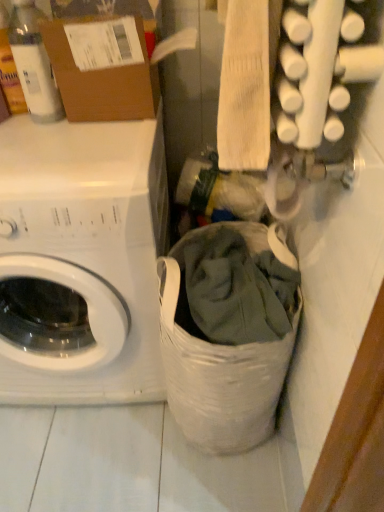
Question: Is white matte washing machine at left aimed at translucent plastic bottle at upper left?

Choices:
 (A) yes
 (B) no

Answer: (B)

Question: Is white matte washing machine at left bigger than translucent plastic bottle at upper left?

Choices:
 (A) yes
 (B) no

Answer: (A)

Question: From a real-world perspective, is white matte washing machine at left physically above translucent plastic bottle at upper left?

Choices:
 (A) no
 (B) yes

Answer: (A)

Question: From the image's perspective, is white matte washing machine at left on translucent plastic bottle at upper left?

Choices:
 (A) no
 (B) yes

Answer: (A)

Question: Is white matte washing machine at left further to the viewer compared to translucent plastic bottle at upper left?

Choices:
 (A) no
 (B) yes

Answer: (A)

Question: From a real-world perspective, is brown cardboard box at upper left above or below white fabric laundry basket at lower center?

Choices:
 (A) above
 (B) below

Answer: (A)

Question: Considering the positions of brown cardboard box at upper left and white fabric laundry basket at lower center in the image, is brown cardboard box at upper left taller or shorter than white fabric laundry basket at lower center?

Choices:
 (A) short
 (B) tall

Answer: (A)

Question: From the image's perspective, is brown cardboard box at upper left above or below white fabric laundry basket at lower center?

Choices:
 (A) below
 (B) above

Answer: (B)

Question: Is brown cardboard box at upper left in front of or behind white fabric laundry basket at lower center in the image?

Choices:
 (A) behind
 (B) front

Answer: (A)

Question: Which is correct: white fabric laundry basket at lower center is inside brown cardboard box at upper left, or outside of it?

Choices:
 (A) inside
 (B) outside

Answer: (B)

Question: From a real-world perspective, is white fabric laundry basket at lower center above or below brown cardboard box at upper left?

Choices:
 (A) below
 (B) above

Answer: (A)

Question: Does point (264, 417) appear closer or farther from the camera than point (129, 41)?

Choices:
 (A) closer
 (B) farther

Answer: (B)

Question: Based on their sizes in the image, would you say white fabric laundry basket at lower center is bigger or smaller than brown cardboard box at upper left?

Choices:
 (A) small
 (B) big

Answer: (B)

Question: In the image, is translucent plastic bottle at upper left positioned in front of or behind white fabric laundry basket at lower center?

Choices:
 (A) front
 (B) behind

Answer: (B)

Question: In terms of height, does translucent plastic bottle at upper left look taller or shorter compared to white fabric laundry basket at lower center?

Choices:
 (A) tall
 (B) short

Answer: (B)